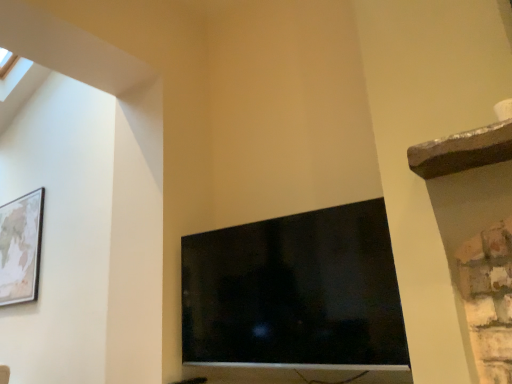
Question: Can you confirm if black glossy tv at center is bigger than wooden framed map at upper left?

Choices:
 (A) no
 (B) yes

Answer: (B)

Question: Is wooden framed map at upper left at the back of black glossy tv at center?

Choices:
 (A) no
 (B) yes

Answer: (A)

Question: From the image's perspective, is black glossy tv at center located beneath wooden framed map at upper left?

Choices:
 (A) no
 (B) yes

Answer: (B)

Question: Does black glossy tv at center lie in front of wooden framed map at upper left?

Choices:
 (A) no
 (B) yes

Answer: (B)

Question: From a real-world perspective, is black glossy tv at center positioned under wooden framed map at upper left based on gravity?

Choices:
 (A) no
 (B) yes

Answer: (B)

Question: Does black glossy tv at center have a greater height compared to wooden framed map at upper left?

Choices:
 (A) yes
 (B) no

Answer: (B)

Question: Is wooden framed map at upper left oriented away from black glossy tv at center?

Choices:
 (A) yes
 (B) no

Answer: (B)

Question: Is wooden framed map at upper left not inside black glossy tv at center?

Choices:
 (A) no
 (B) yes

Answer: (B)

Question: From a real-world perspective, is wooden framed map at upper left positioned over black glossy tv at center based on gravity?

Choices:
 (A) no
 (B) yes

Answer: (B)

Question: Is the position of wooden framed map at upper left more distant than that of black glossy tv at center?

Choices:
 (A) yes
 (B) no

Answer: (A)

Question: Does wooden framed map at upper left have a lesser height compared to black glossy tv at center?

Choices:
 (A) no
 (B) yes

Answer: (A)

Question: Considering the relative positions of wooden framed map at upper left and black glossy tv at center in the image provided, is wooden framed map at upper left to the left of black glossy tv at center from the viewer's perspective?

Choices:
 (A) no
 (B) yes

Answer: (B)

Question: Based on their positions, is black glossy tv at center located to the left or right of wooden framed map at upper left?

Choices:
 (A) left
 (B) right

Answer: (B)